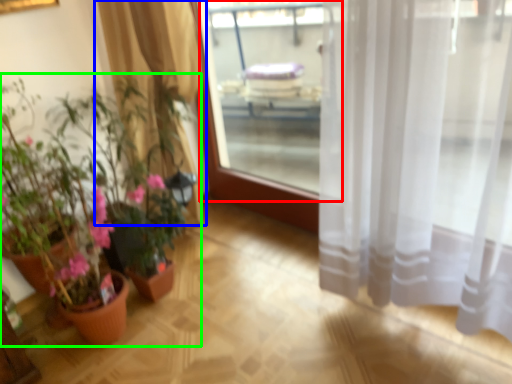
Question: Which object is the closest to the window screen (highlighted by a red box)? Choose among these: curtain (highlighted by a blue box) or houseplant (highlighted by a green box).

Choices:
 (A) curtain
 (B) houseplant

Answer: (A)